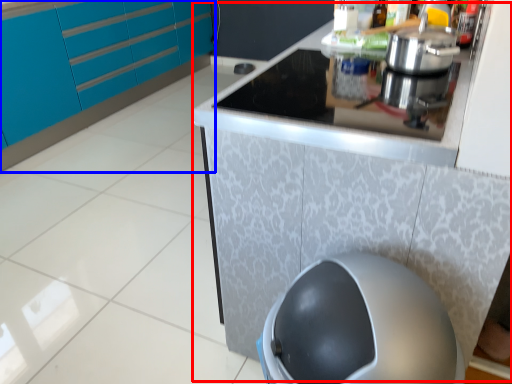
Question: Which of the following is the farthest to the observer, counter (highlighted by a red box) or cabinetry (highlighted by a blue box)?

Choices:
 (A) counter
 (B) cabinetry

Answer: (B)